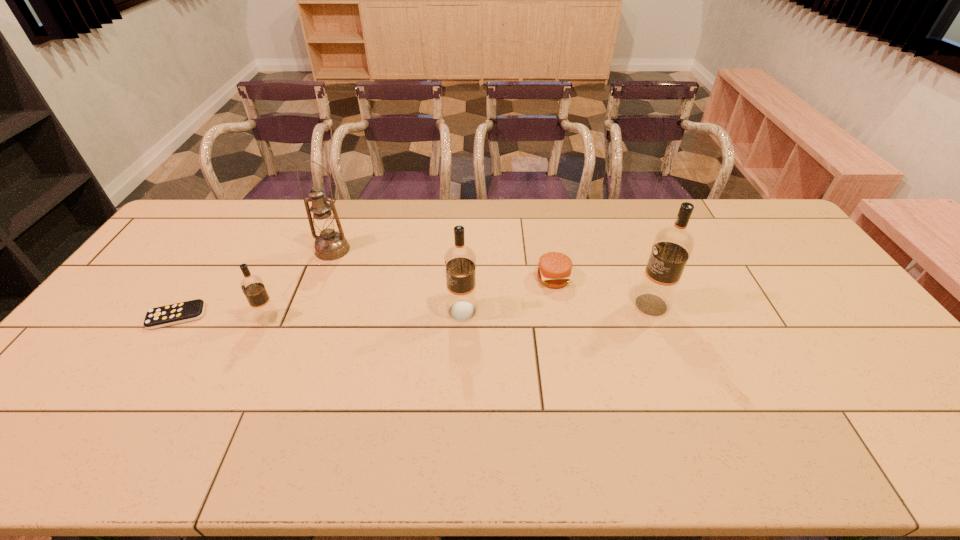
Please point a spot on the right to add another vodka. Please provide its 2D coordinates. Your answer should be formatted as a tuple, i.e. [(x, y)], where the tuple contains the x and y coordinates of a point satisfying the conditions above.

[(835, 299)]